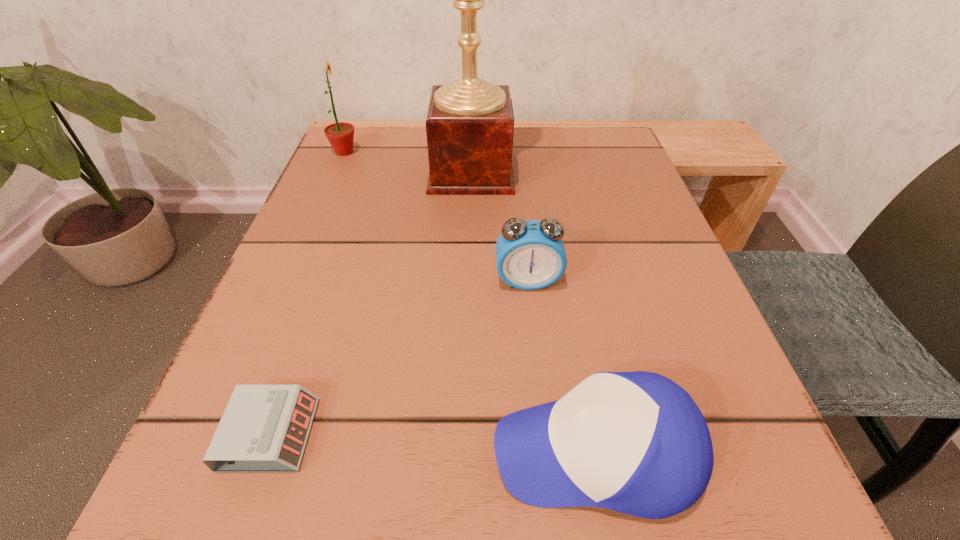
Locate an element on the screen. vacant area located 0.180m on the front-facing side of the fourth tallest object is located at coordinates (329, 451).

You are a GUI agent. You are given a task and a screenshot of the screen. Output one action in this format:
    pyautogui.click(x=<x>, y=<y>)
    Task: Click on the blank area located on the front-facing side of the fourth tallest object
    The image size is (960, 540).
    Given the screenshot: What is the action you would take?
    pyautogui.click(x=366, y=451)

I want to click on free location located on the front-facing side of the fourth tallest object, so click(302, 451).

Where is `free space located 0.070m on the back of the nearer alarm clock`? free space located 0.070m on the back of the nearer alarm clock is located at coordinates (300, 351).

At what (x,y) coordinates should I click in order to perform the action: click on trophy cup located at the far edge. Please return your answer as a coordinate pair (x, y). The image size is (960, 540). Looking at the image, I should click on (470, 122).

Locate an element on the screen. The height and width of the screenshot is (540, 960). sunflower located in the far edge section of the desktop is located at coordinates point(340,135).

Where is `baseball cap located in the near edge section of the desktop`? This screenshot has width=960, height=540. baseball cap located in the near edge section of the desktop is located at coordinates (635, 442).

Find the location of `alarm clock at the near edge`. alarm clock at the near edge is located at coordinates (264, 429).

At what (x,y) coordinates should I click in order to perform the action: click on sunflower that is at the left edge. Please return your answer as a coordinate pair (x, y). The width and height of the screenshot is (960, 540). Looking at the image, I should click on (340, 135).

The image size is (960, 540). In order to click on alarm clock that is at the left edge in this screenshot , I will do `click(264, 429)`.